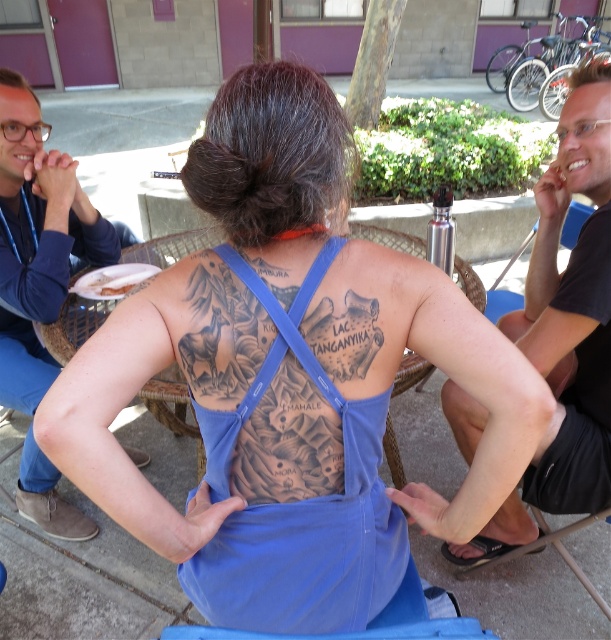
You are a tailor who needs to determine which item has a greater width to create a matching accessory. Which item between the blue fabric apron at center and the blue denim jeans at left is wider?

The blue fabric apron at center is wider than the blue denim jeans at left, so the accessory should be made to match the apron.

You are a photographer trying to capture a closeup of the blue fabric apron at center. You are currently holding the camera and standing 33.54 inches away from the apron. Can you get a clear closeup shot without moving closer?

The blue fabric apron at center and camera are 33.54 inches apart. Since the minimum focusing distance for most cameras is around 8 inches, you can get a clear closeup shot without moving closer.

You are a photographer adjusting your camera to focus on two points in the scene. The first point is point (536, 529) and the second is point (12, 314). Which point should you focus on first if you want to capture the closest object to the camera?

Point (536, 529) is closer to the camera than point (12, 314), so you should focus on point (536, 529) first to capture the closest object.